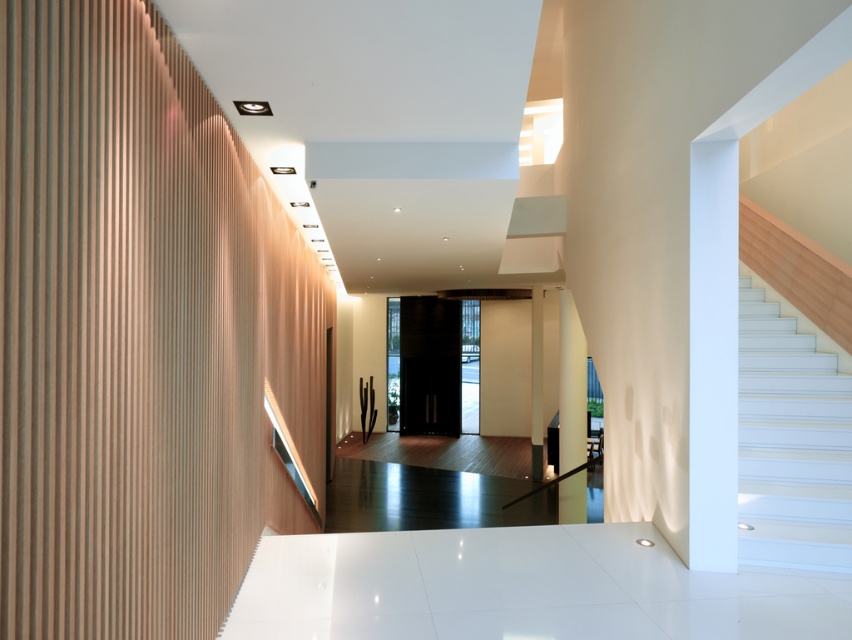
Is white glossy stairs at right smaller than white glossy pillar at center?

Incorrect, white glossy stairs at right is not smaller in size than white glossy pillar at center.

Does white glossy stairs at right appear under white glossy pillar at center?

No, white glossy stairs at right is not below white glossy pillar at center.

Where is `white glossy stairs at right`? white glossy stairs at right is located at coordinates (790, 442).

Image resolution: width=852 pixels, height=640 pixels. I want to click on white glossy stairs at right, so click(790, 442).